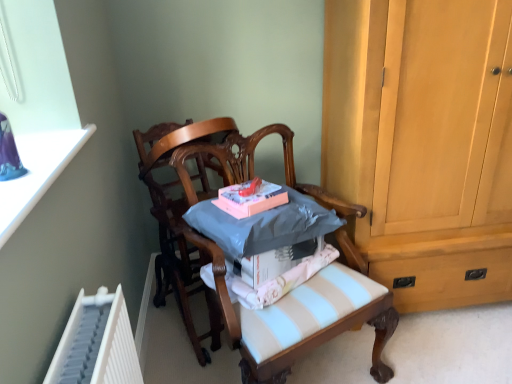
This screenshot has width=512, height=384. Describe the element at coordinates (278, 279) in the screenshot. I see `light blue striped fabric at center` at that location.

At what (x,y) coordinates should I click in order to perform the action: click on pink matte book at center. Please return your answer as a coordinate pair (x, y). This screenshot has width=512, height=384. Looking at the image, I should click on (250, 198).

Image resolution: width=512 pixels, height=384 pixels. Describe the element at coordinates (180, 221) in the screenshot. I see `wooden chair at center, the 1th chair in the left-to-right sequence` at that location.

I want to click on light brown wood cabinet at right, so click(x=424, y=142).

Where is `light blue striped fabric at center`? The height and width of the screenshot is (384, 512). light blue striped fabric at center is located at coordinates (278, 279).

Considering the positions of points (276, 124) and (234, 275), is point (276, 124) farther from camera compared to point (234, 275)?

That is True.

Looking at this image, which of these two, wooden chair at center, the 2th chair viewed from the left, or light blue striped fabric at center, stands shorter?

With less height is light blue striped fabric at center.

Which object is closer to the camera, wooden chair at center, the 1th chair in the left-to-right sequence, or wooden chair at center, the 2th chair viewed from the left?

wooden chair at center, the 2th chair viewed from the left.

Is wooden chair at center, the second chair positioned from the right, aimed at wooden chair at center, the 2th chair viewed from the left?

Yes, wooden chair at center, the second chair positioned from the right, is turned towards wooden chair at center, the 2th chair viewed from the left.

Can you confirm if wooden chair at center, the second chair positioned from the right, is taller than wooden chair at center, marked as the 1th chair in a right-to-left arrangement?

Yes.

I want to click on chair that appears below the wooden chair at center, the second chair positioned from the right (from a real-world perspective), so click(300, 337).

Identify the location of chair below the wooden chair at center, the second chair positioned from the right (from a real-world perspective). Image resolution: width=512 pixels, height=384 pixels. (300, 337).

How far apart are wooden chair at center, marked as the 1th chair in a right-to-left arrangement, and wooden chair at center, the second chair positioned from the right?

wooden chair at center, marked as the 1th chair in a right-to-left arrangement, and wooden chair at center, the second chair positioned from the right, are 26.97 centimeters apart from each other.

Is point (248, 148) positioned behind point (187, 280)?

No, (248, 148) is closer to viewer.

From a real-world perspective, is wooden chair at center, marked as the 1th chair in a right-to-left arrangement, physically located above or below wooden chair at center, the 1th chair in the left-to-right sequence?

Clearly, from a real-world perspective, wooden chair at center, marked as the 1th chair in a right-to-left arrangement, is below wooden chair at center, the 1th chair in the left-to-right sequence.

The width and height of the screenshot is (512, 384). Find the location of `cabinetry above the wooden chair at center, marked as the 1th chair in a right-to-left arrangement (from a real-world perspective)`. cabinetry above the wooden chair at center, marked as the 1th chair in a right-to-left arrangement (from a real-world perspective) is located at coordinates (424, 142).

How different are the orientations of wooden chair at center, the 2th chair viewed from the left, and light brown wood cabinet at right in degrees?

wooden chair at center, the 2th chair viewed from the left, and light brown wood cabinet at right are facing 30 degrees away from each other.

Is wooden chair at center, marked as the 1th chair in a right-to-left arrangement, in front of or behind light brown wood cabinet at right in the image?

Clearly, wooden chair at center, marked as the 1th chair in a right-to-left arrangement, is in front of light brown wood cabinet at right.

Does wooden chair at center, the 2th chair viewed from the left, have a greater height compared to light brown wood cabinet at right?

In fact, wooden chair at center, the 2th chair viewed from the left, may be shorter than light brown wood cabinet at right.

Is light brown wood cabinet at right touching light blue striped fabric at center?

No.

Based on the photo, which object is further away from the camera taking this photo, light brown wood cabinet at right or light blue striped fabric at center?

Positioned behind is light blue striped fabric at center.

Measure the distance between light brown wood cabinet at right and light blue striped fabric at center.

The distance of light brown wood cabinet at right from light blue striped fabric at center is 21.85 inches.

Consider the image. From a real-world perspective, which is physically above, light brown wood cabinet at right or light blue striped fabric at center?

light brown wood cabinet at right is physically above.

From the picture: Which is more to the right, wooden chair at center, the 1th chair in the left-to-right sequence, or light blue striped fabric at center?

Positioned to the right is light blue striped fabric at center.

Is wooden chair at center, the 1th chair in the left-to-right sequence, in front of or behind light blue striped fabric at center in the image?

wooden chair at center, the 1th chair in the left-to-right sequence, is positioned farther from the viewer than light blue striped fabric at center.

From a real-world perspective, is wooden chair at center, the second chair positioned from the right, positioned above or below light blue striped fabric at center?

From a real-world perspective, wooden chair at center, the second chair positioned from the right, is physically above light blue striped fabric at center.

Who is bigger, wooden chair at center, the second chair positioned from the right, or light blue striped fabric at center?

wooden chair at center, the second chair positioned from the right.

Can you tell me how much wooden chair at center, the 2th chair viewed from the left, and pink matte book at center differ in facing direction?

They differ by 4.79 degrees in their facing directions.

Could pink matte book at center be considered to be inside wooden chair at center, marked as the 1th chair in a right-to-left arrangement?

Yes, pink matte book at center can be found within wooden chair at center, marked as the 1th chair in a right-to-left arrangement.

Is wooden chair at center, marked as the 1th chair in a right-to-left arrangement, far from pink matte book at center?

No, wooden chair at center, marked as the 1th chair in a right-to-left arrangement, is not far from pink matte book at center.

Could you tell me if wooden chair at center, marked as the 1th chair in a right-to-left arrangement, is turned towards pink matte book at center?

No, wooden chair at center, marked as the 1th chair in a right-to-left arrangement, is not turned towards pink matte book at center.

Identify the location of chair that appears on the right of light blue striped fabric at center. The image size is (512, 384). (300, 337).

This screenshot has width=512, height=384. Find the location of `chair below the wooden chair at center, the second chair positioned from the right (from the image's perspective)`. chair below the wooden chair at center, the second chair positioned from the right (from the image's perspective) is located at coordinates (300, 337).

When comparing their distances from light brown wood cabinet at right, does wooden chair at center, the second chair positioned from the right, or pink matte book at center seem further?

Among the two, wooden chair at center, the second chair positioned from the right, is located further to light brown wood cabinet at right.

Looking at the image, which one is located further to wooden chair at center, the 2th chair viewed from the left, pink matte book at center or light blue striped fabric at center?

Based on the image, pink matte book at center appears to be further to wooden chair at center, the 2th chair viewed from the left.

Looking at this image, looking at the image, which one is located closer to wooden chair at center, the 2th chair viewed from the left, pink matte book at center or wooden chair at center, the 1th chair in the left-to-right sequence?

The object closer to wooden chair at center, the 2th chair viewed from the left, is wooden chair at center, the 1th chair in the left-to-right sequence.

Based on their spatial positions, is light blue striped fabric at center or wooden chair at center, the 1th chair in the left-to-right sequence, closer to pink matte book at center?

Based on the image, light blue striped fabric at center appears to be nearer to pink matte book at center.

Based on their spatial positions, is light blue striped fabric at center or pink matte book at center further from wooden chair at center, the 2th chair viewed from the left?

pink matte book at center is positioned further to the anchor wooden chair at center, the 2th chair viewed from the left.

Based on their spatial positions, is light brown wood cabinet at right or light blue striped fabric at center further from pink matte book at center?

Based on the image, light brown wood cabinet at right appears to be further to pink matte book at center.

Considering their positions, is wooden chair at center, the 1th chair in the left-to-right sequence, positioned closer to light blue striped fabric at center than light brown wood cabinet at right?

wooden chair at center, the 1th chair in the left-to-right sequence, lies closer to light blue striped fabric at center than the other object.

Looking at the image, which one is located closer to light blue striped fabric at center, pink matte book at center or wooden chair at center, marked as the 1th chair in a right-to-left arrangement?

wooden chair at center, marked as the 1th chair in a right-to-left arrangement, is positioned closer to the anchor light blue striped fabric at center.

In order to click on book between wooden chair at center, the second chair positioned from the right, and light blue striped fabric at center in this screenshot , I will do `click(250, 198)`.

This screenshot has height=384, width=512. I want to click on fabric between wooden chair at center, the second chair positioned from the right, and light brown wood cabinet at right from left to right, so click(x=278, y=279).

The height and width of the screenshot is (384, 512). Find the location of `fabric situated between pink matte book at center and light brown wood cabinet at right from left to right`. fabric situated between pink matte book at center and light brown wood cabinet at right from left to right is located at coordinates (278, 279).

I want to click on book located between wooden chair at center, the second chair positioned from the right, and light brown wood cabinet at right in the left-right direction, so click(x=250, y=198).